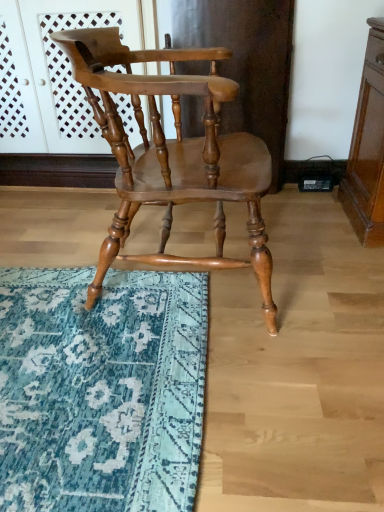
Question: Looking at their shapes, would you say matte wood screen door at upper center is wider or thinner than teal rug at lower left?

Choices:
 (A) thin
 (B) wide

Answer: (A)

Question: Relative to teal rug at lower left, is matte wood screen door at upper center in front or behind?

Choices:
 (A) behind
 (B) front

Answer: (A)

Question: Which object is the closest to the matte wood screen door at upper center?

Choices:
 (A) shiny brown wood chair at center
 (B) teal rug at lower left

Answer: (A)

Question: Which of these objects is positioned farthest from the teal rug at lower left?

Choices:
 (A) shiny brown wood chair at center
 (B) matte wood screen door at upper center

Answer: (B)